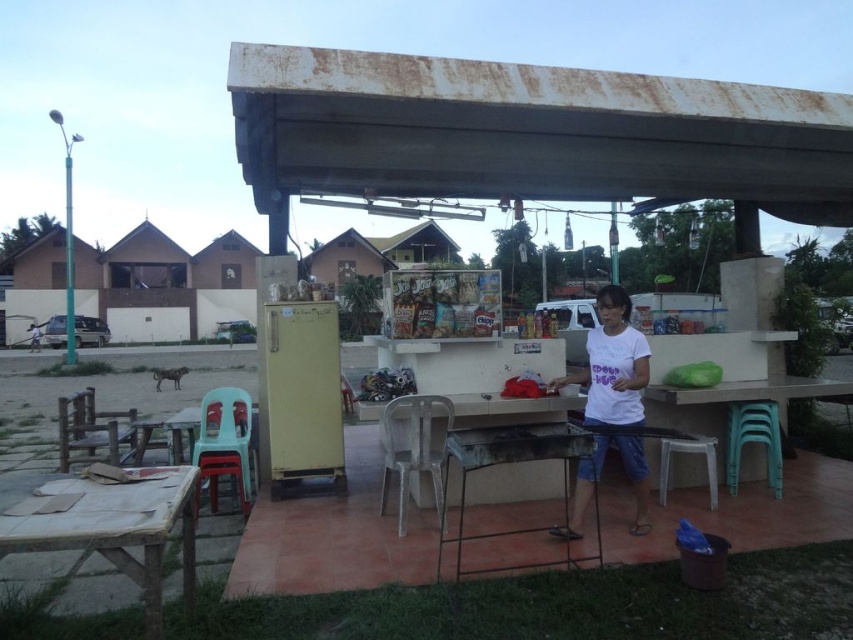
Question: Where is metallic gray grill at center located in relation to white plastic stool at lower right in the image?

Choices:
 (A) right
 (B) left

Answer: (B)

Question: Estimate the real-world distances between objects in this image. Which object is closer to the white plastic stool at lower right?

Choices:
 (A) wooden table at lower left
 (B) metallic gray grill at center
 (C) green plastic table at center

Answer: (C)

Question: Does green plastic table at center come behind white plastic stool at lower right?

Choices:
 (A) yes
 (B) no

Answer: (A)

Question: Which object appears closest to the camera in this image?

Choices:
 (A) wooden table at lower left
 (B) green plastic table at center
 (C) white plastic stool at lower right
 (D) metallic gray grill at center

Answer: (A)

Question: Which of the following is the closest to the observer?

Choices:
 (A) white plastic stool at lower right
 (B) wooden table at lower left
 (C) metallic gray grill at center
 (D) green plastic table at center

Answer: (B)

Question: Does wooden table at lower left have a larger size compared to green plastic table at center?

Choices:
 (A) no
 (B) yes

Answer: (A)